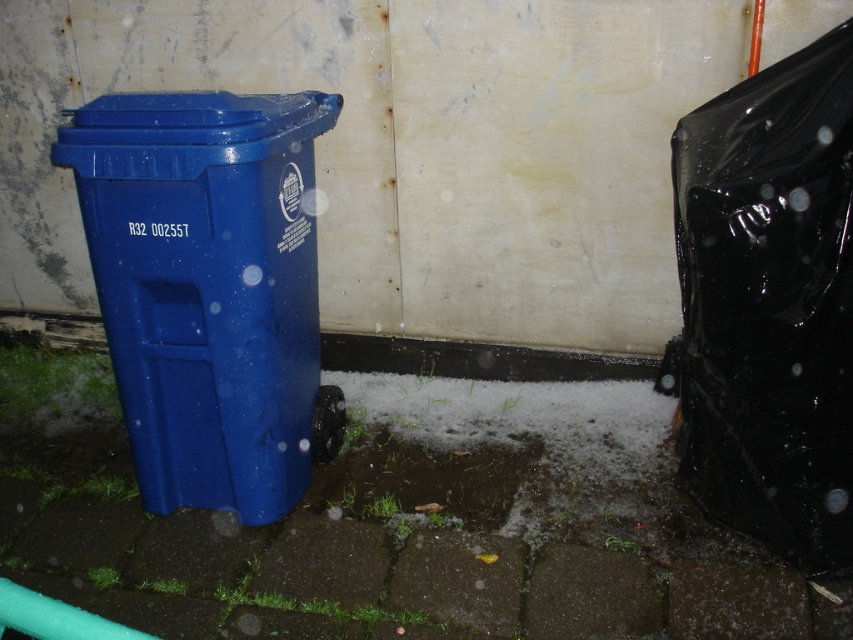
Which is more to the right, smooth concrete pavement at center or matte plastic recycling bin at left?

smooth concrete pavement at center

Is smooth concrete pavement at center below matte plastic recycling bin at left?

Yes.

Does point (444, 452) come behind point (277, 451)?

Yes, it is behind point (277, 451).

Identify the location of smooth concrete pavement at center. Image resolution: width=853 pixels, height=640 pixels. (396, 522).

Is matte plastic recycling bin at left above black glossy trash bag at right?

Actually, matte plastic recycling bin at left is below black glossy trash bag at right.

Is matte plastic recycling bin at left taller than black glossy trash bag at right?

No.

Where is `matte plastic recycling bin at left`? Image resolution: width=853 pixels, height=640 pixels. matte plastic recycling bin at left is located at coordinates (209, 289).

The width and height of the screenshot is (853, 640). What are the coordinates of `matte plastic recycling bin at left` in the screenshot? It's located at (209, 289).

What do you see at coordinates (396, 522) in the screenshot?
I see `smooth concrete pavement at center` at bounding box center [396, 522].

Does smooth concrete pavement at center have a greater width compared to black glossy trash bag at right?

Yes, smooth concrete pavement at center is wider than black glossy trash bag at right.

Describe the element at coordinates (396, 522) in the screenshot. I see `smooth concrete pavement at center` at that location.

Image resolution: width=853 pixels, height=640 pixels. Identify the location of smooth concrete pavement at center. (396, 522).